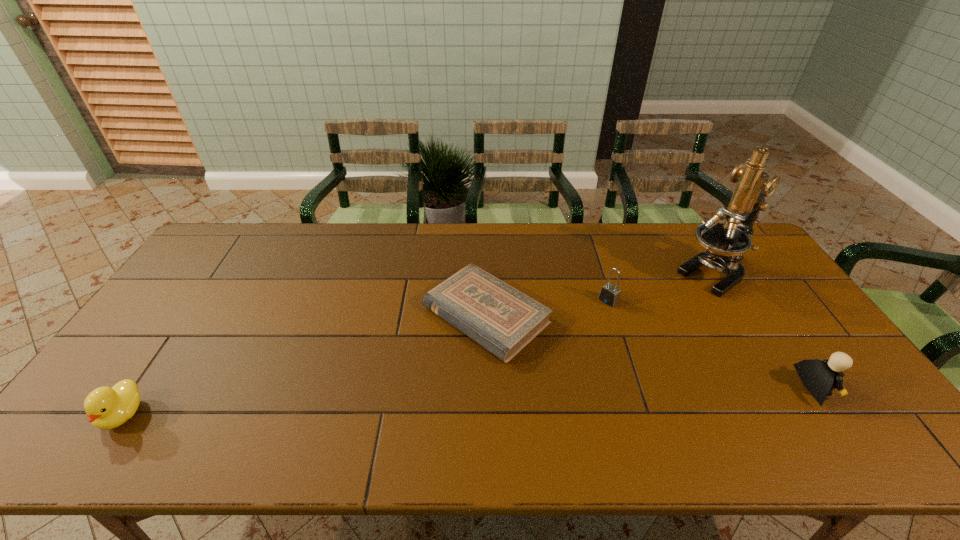
Find the location of `the second shortest object`. the second shortest object is located at coordinates (106, 408).

Where is `the leftmost object`? The width and height of the screenshot is (960, 540). the leftmost object is located at coordinates (106, 408).

The image size is (960, 540). Identify the location of Lego. (819, 377).

Identify the location of the tallest object. (725, 243).

Where is `padlock`? The image size is (960, 540). padlock is located at coordinates (609, 294).

Locate an element on the screen. The width and height of the screenshot is (960, 540). the shortest object is located at coordinates (503, 320).

Where is `the second object from left to right`? the second object from left to right is located at coordinates (503, 320).

The height and width of the screenshot is (540, 960). Identify the location of vacant space located 0.320m at the eyepiece of the tallest object. (628, 334).

You are a GUI agent. You are given a task and a screenshot of the screen. Output one action in this format:
    pyautogui.click(x=<x>, y=<y>)
    Task: Click on the free space located at the eyepiece of the tallest object
    The image size is (960, 540).
    Given the screenshot: What is the action you would take?
    pyautogui.click(x=618, y=341)

Where is `vacant area situated 0.320m at the eyepiece of the tallest object`? This screenshot has width=960, height=540. vacant area situated 0.320m at the eyepiece of the tallest object is located at coordinates (628, 334).